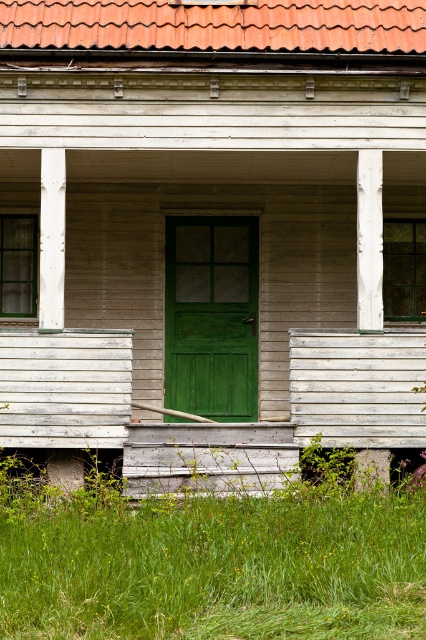
Question: Among these points, which one is nearest to the camera?

Choices:
 (A) (328, 138)
 (B) (365, 252)

Answer: (A)

Question: From the image, what is the correct spatial relationship of green wood door at center in relation to white painted wood post at center?

Choices:
 (A) left
 (B) right

Answer: (A)

Question: Does green grass at lower center appear on the left side of white wood column at left?

Choices:
 (A) yes
 (B) no

Answer: (B)

Question: Is green wood door at center smaller than smooth white wooden post at lower right?

Choices:
 (A) no
 (B) yes

Answer: (A)

Question: Which point is closer to the camera taking this photo?

Choices:
 (A) (382, 244)
 (B) (40, 225)
 (C) (365, 477)

Answer: (C)

Question: Which point is farther to the camera?

Choices:
 (A) white painted wood post at center
 (B) green wood door at center
 (C) green grass at lower center
 (D) smooth white wooden post at lower right

Answer: (B)